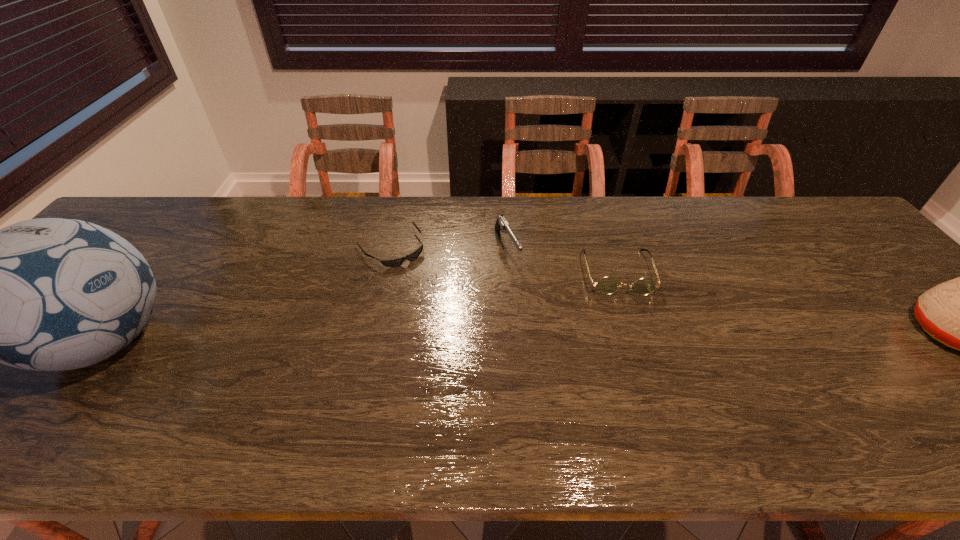
Find the location of `vacant space on the desktop that is between the leftmost object and the rightmost object and is positioned on the front-facing side of the shortest object`. vacant space on the desktop that is between the leftmost object and the rightmost object and is positioned on the front-facing side of the shortest object is located at coordinates (459, 338).

The image size is (960, 540). Find the location of `vacant space on the desktop that is between the leftmost object and the pottery and is positioned on the lenses of the second shortest object`. vacant space on the desktop that is between the leftmost object and the pottery and is positioned on the lenses of the second shortest object is located at coordinates (634, 336).

Image resolution: width=960 pixels, height=540 pixels. I want to click on vacant space on the desktop that is between the leftmost object and the rightmost object and is positioned on the front-facing side of the third object from left to right, so click(x=560, y=336).